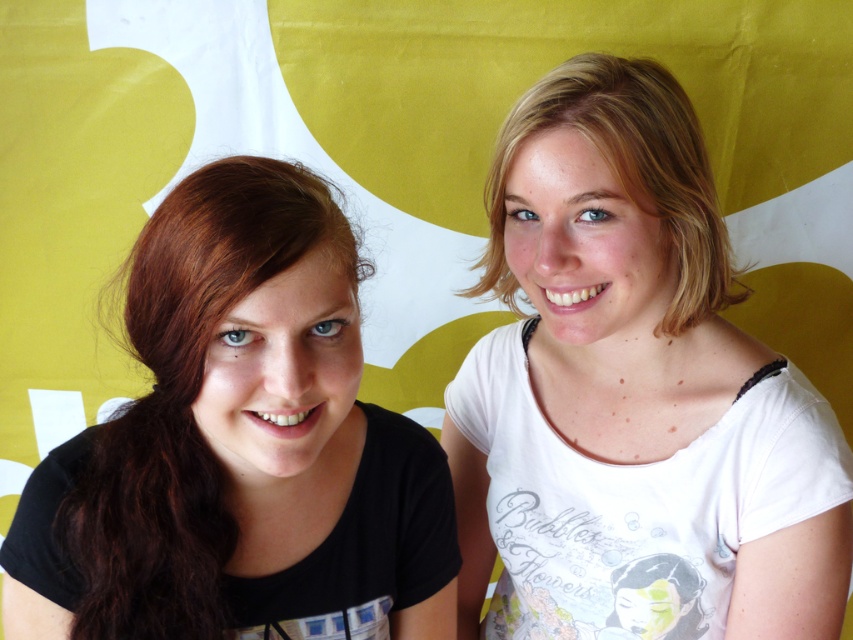
You are taking a photo of two people standing against a colorful background. You notice two specific points marked in the image. The first point is at coordinate point(364, 460) and the second at point(508, 278). Based on their positions, which point is nearer to the camera?

Point(364, 460) is closer to the camera than point(508, 278).